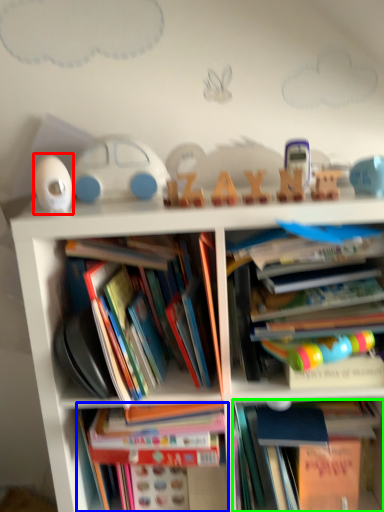
Question: Based on their relative distances, which object is farther from toy (highlighted by a red box)? Choose from book (highlighted by a blue box) and book (highlighted by a green box).

Choices:
 (A) book
 (B) book

Answer: (B)